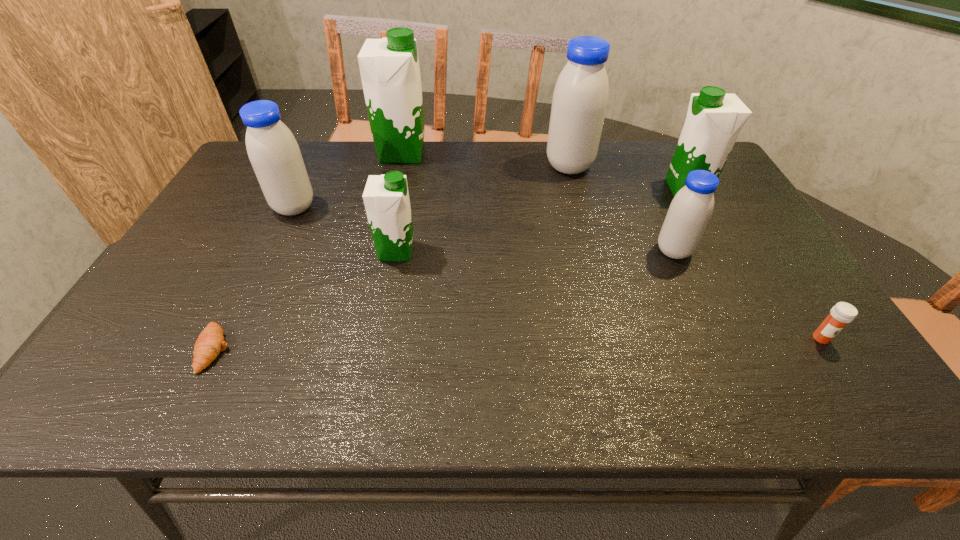
Find the location of `vacant area that lies between the second blue soya milk from right to left and the rightmost blue soya milk`. vacant area that lies between the second blue soya milk from right to left and the rightmost blue soya milk is located at coordinates (621, 208).

I want to click on object that is the second nearest to the second shortest object, so click(x=714, y=119).

Point out which object is positioned as the third nearest to the second soya milk from right to left. Please provide its 2D coordinates. Your answer should be formatted as a tuple, i.e. [(x, y)], where the tuple contains the x and y coordinates of a point satisfying the conditions above.

[(580, 98)]

Select which soya milk appears as the fifth closest to the second blue soya milk from right to left. Please provide its 2D coordinates. Your answer should be formatted as a tuple, i.e. [(x, y)], where the tuple contains the x and y coordinates of a point satisfying the conditions above.

[(273, 151)]

The image size is (960, 540). I want to click on soya milk that can be found as the second closest to the third soya milk from right to left, so click(691, 209).

Where is `green soya milk that is the second nearest to the smallest green soya milk`? Image resolution: width=960 pixels, height=540 pixels. green soya milk that is the second nearest to the smallest green soya milk is located at coordinates (714, 119).

Locate an element on the screen. The height and width of the screenshot is (540, 960). green soya milk identified as the closest to the nearest green soya milk is located at coordinates (389, 67).

Identify the location of the closest blue soya milk relative to the nearest blue soya milk. (580, 98).

The height and width of the screenshot is (540, 960). I want to click on the second closest blue soya milk to the biggest green soya milk, so click(x=580, y=98).

Where is `free spot that satisfies the following two spatial constraints: 1. on the front-facing side of the smallest green soya milk; 2. on the front side of the shortest object`? free spot that satisfies the following two spatial constraints: 1. on the front-facing side of the smallest green soya milk; 2. on the front side of the shortest object is located at coordinates (377, 349).